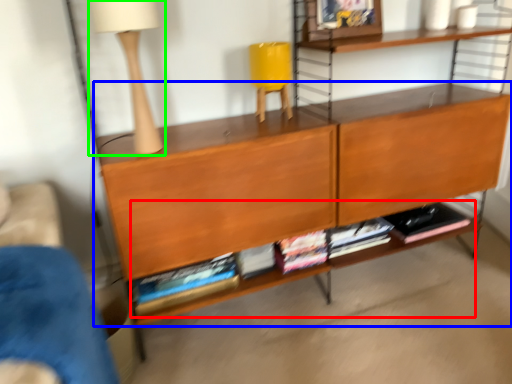
Question: Which is nearer to the book (highlighted by a red box)? shelf (highlighted by a blue box) or table lamp (highlighted by a green box).

Choices:
 (A) shelf
 (B) table lamp

Answer: (A)